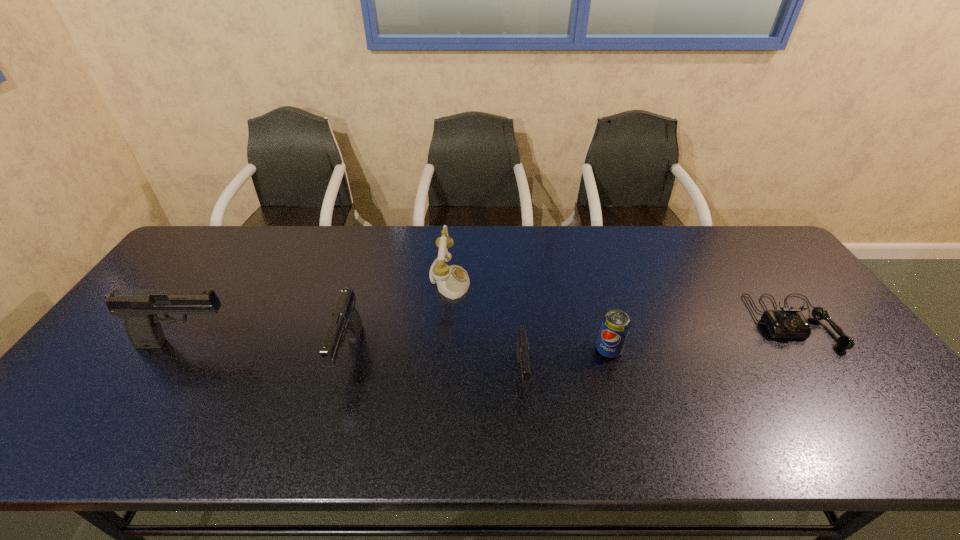
Find the location of `the leftmost object`. the leftmost object is located at coordinates (138, 307).

Locate an element on the screen. This screenshot has height=540, width=960. the fifth object from right to left is located at coordinates (346, 322).

Find the location of `the second pistol from right to left`. the second pistol from right to left is located at coordinates (x=346, y=322).

Identify the location of the rightmost pistol. (522, 351).

At what (x,y) coordinates should I click in order to perform the action: click on the third object from right to left. Please return your answer as a coordinate pair (x, y). Looking at the image, I should click on (522, 351).

Find the location of `the shortest object`. the shortest object is located at coordinates (789, 322).

Locate an element on the screen. The width and height of the screenshot is (960, 540). the right telephone is located at coordinates (789, 322).

The width and height of the screenshot is (960, 540). I want to click on the left telephone, so pyautogui.click(x=452, y=281).

Find the location of a particular element. Image resolution: width=960 pixels, height=540 pixels. the third object from left to right is located at coordinates (452, 281).

You are a GUI agent. You are given a task and a screenshot of the screen. Output one action in this format:
    pyautogui.click(x=<x>, y=<y>)
    Task: Click on the fifth object from left to right
    This screenshot has width=960, height=540.
    Given the screenshot: What is the action you would take?
    pyautogui.click(x=615, y=326)